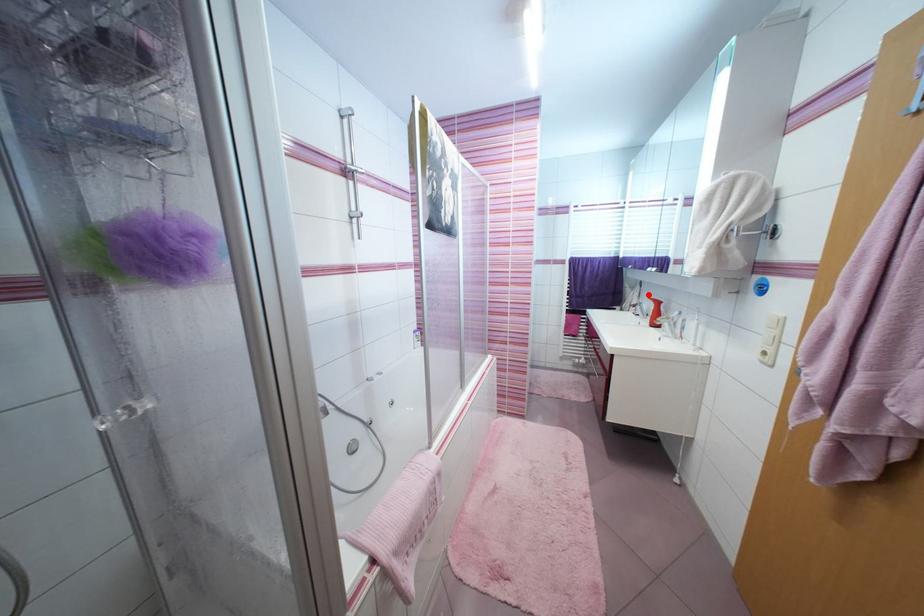
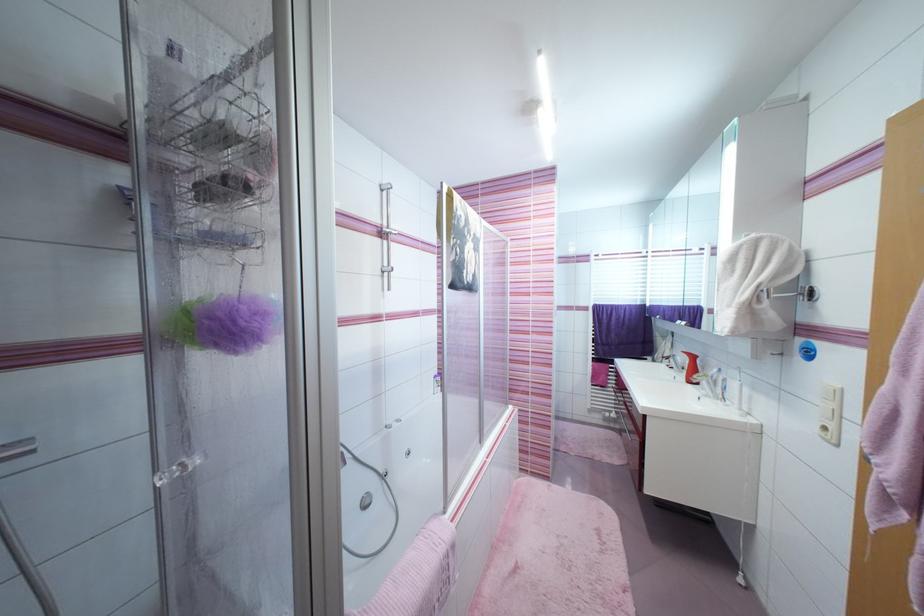
Question: I am providing you with two images of the same scene from different viewpoints. Given a red point in image1, look at the same physical point in image2. Is it:

Choices:
 (A) Closer to the viewpoint
 (B) Farther from the viewpoint

Answer: (B)